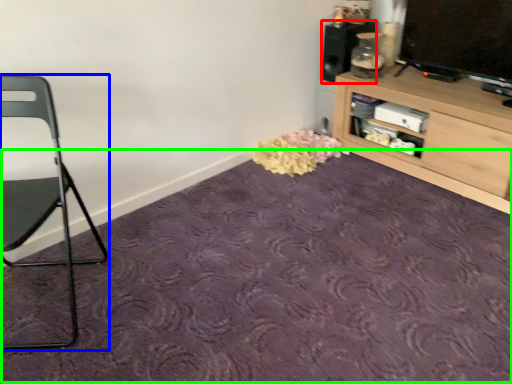
Question: Which object is the closest to the speaker (highlighted by a red box)? Choose among these: chair (highlighted by a blue box) or plain (highlighted by a green box).

Choices:
 (A) chair
 (B) plain

Answer: (B)